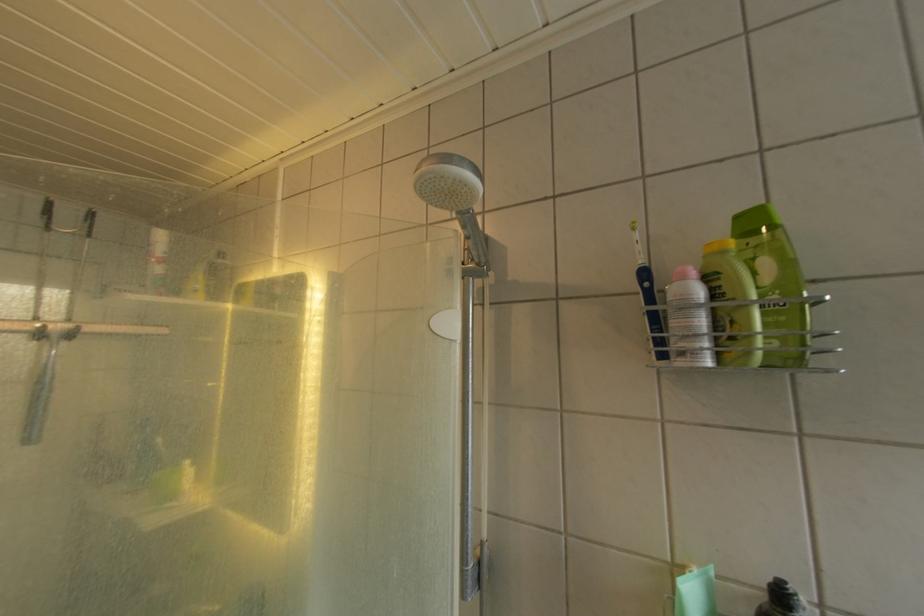
Find the location of `shower head holder`. shower head holder is located at coordinates (467, 446).